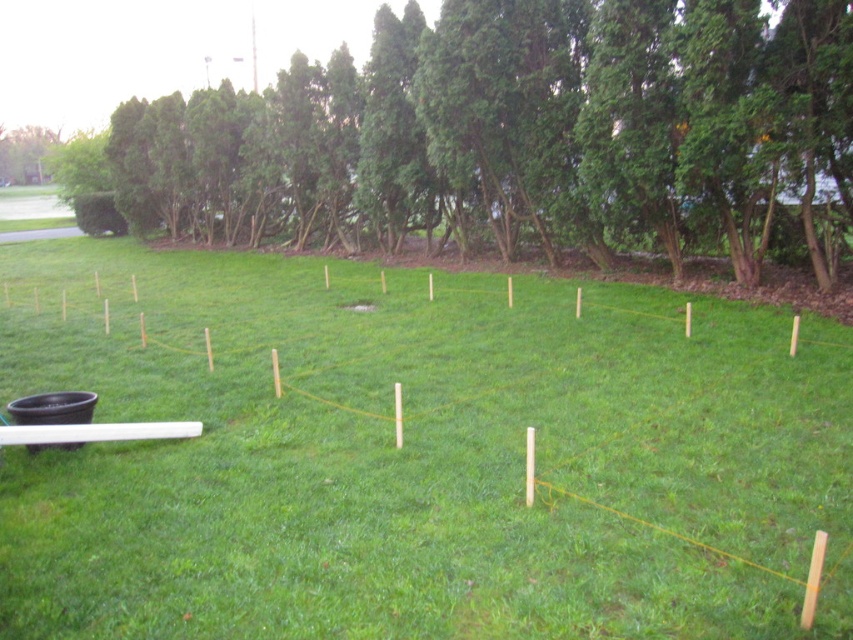
You are planning to install a new garden in the area shown. Considering the sizes of the green grass at center and the green leafy tree at upper center, which one would require more space for planting?

The green leafy tree at upper center requires more space for planting since it is larger than the green grass at center.

You are standing at the center of the grassy area and want to place a small garden gnome exactly at the point where the green grass at center is located. According to the coordinates provided, what are the exact coordinates where you should place the gnome?

The exact coordinates for placing the garden gnome are at point (415, 456) where the green grass at center is located.